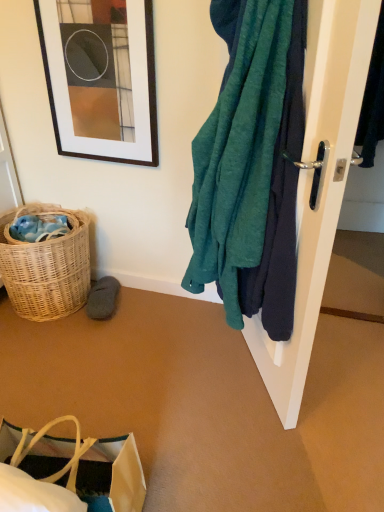
Question: Considering the relative sizes of white glossy door handle at right and brown paper bag at lower left in the image provided, is white glossy door handle at right thinner than brown paper bag at lower left?

Choices:
 (A) yes
 (B) no

Answer: (A)

Question: Is white glossy door handle at right at the left side of brown paper bag at lower left?

Choices:
 (A) yes
 (B) no

Answer: (B)

Question: Is white glossy door handle at right positioned beyond the bounds of brown paper bag at lower left?

Choices:
 (A) yes
 (B) no

Answer: (A)

Question: From a real-world perspective, is white glossy door handle at right below brown paper bag at lower left?

Choices:
 (A) no
 (B) yes

Answer: (A)

Question: Can you confirm if white glossy door handle at right is bigger than brown paper bag at lower left?

Choices:
 (A) yes
 (B) no

Answer: (A)

Question: From a real-world perspective, relative to gray suede slipper at lower left, is teal fabric towel at right vertically above or below?

Choices:
 (A) below
 (B) above

Answer: (B)

Question: Is teal fabric towel at right in front of or behind gray suede slipper at lower left in the image?

Choices:
 (A) behind
 (B) front

Answer: (B)

Question: Is teal fabric towel at right inside or outside of gray suede slipper at lower left?

Choices:
 (A) outside
 (B) inside

Answer: (A)

Question: Would you say teal fabric towel at right is to the left or to the right of gray suede slipper at lower left in the picture?

Choices:
 (A) right
 (B) left

Answer: (A)

Question: Do you think teal fabric towel at right is within matte black picture frame at upper left, or outside of it?

Choices:
 (A) inside
 (B) outside

Answer: (B)

Question: In terms of height, does teal fabric towel at right look taller or shorter compared to matte black picture frame at upper left?

Choices:
 (A) short
 (B) tall

Answer: (B)

Question: Considering their positions, is teal fabric towel at right located in front of or behind matte black picture frame at upper left?

Choices:
 (A) front
 (B) behind

Answer: (A)

Question: Based on their positions, is teal fabric towel at right located to the left or right of matte black picture frame at upper left?

Choices:
 (A) left
 (B) right

Answer: (B)

Question: From a real-world perspective, relative to white glossy door handle at right, is woven wicker basket at lower left vertically above or below?

Choices:
 (A) below
 (B) above

Answer: (A)

Question: From the image's perspective, relative to white glossy door handle at right, is woven wicker basket at lower left above or below?

Choices:
 (A) below
 (B) above

Answer: (A)